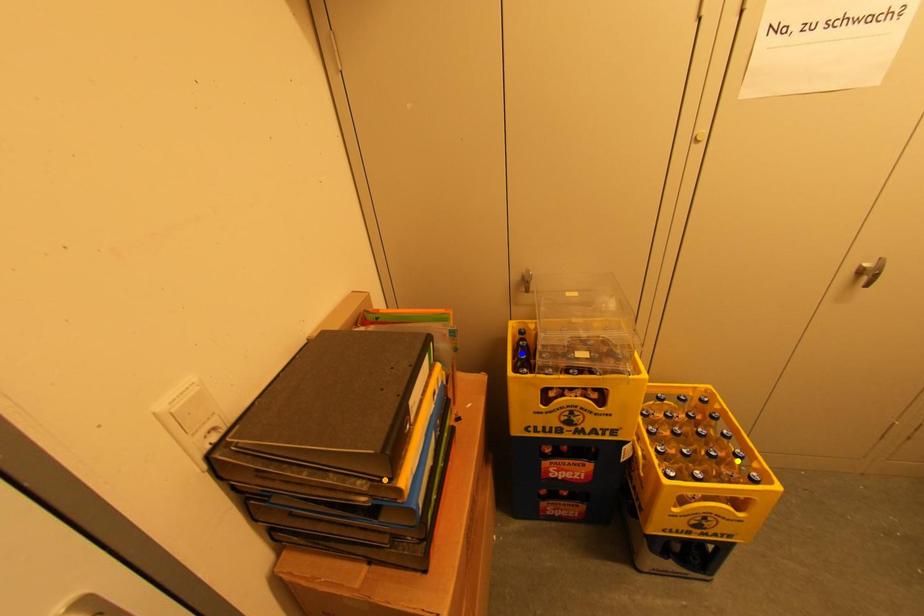
Order these from nearest to farthest:
orange point, blue point, yellow point

orange point
yellow point
blue point